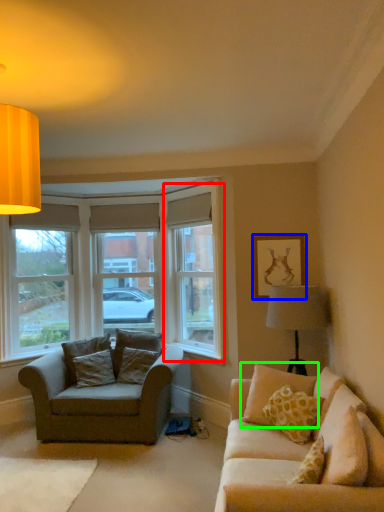
Question: Which object is positioned closest to window screen (highlighted by a red box)? Select from picture frame (highlighted by a blue box) and pillow (highlighted by a green box).

Choices:
 (A) picture frame
 (B) pillow

Answer: (A)